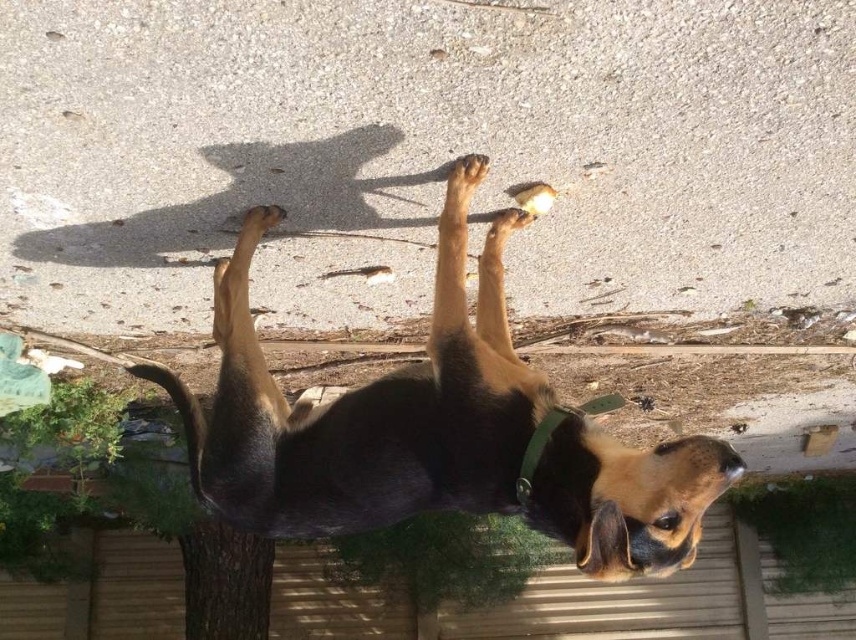
You are a photographer trying to capture the dog in the image. You notice the black fur dog at center and the brown fuzzy paw at upper center. Which object is closer to the camera?

The brown fuzzy paw at upper center is closer to the camera because the black fur dog at center is positioned under it.

You are standing at the position of the dog and want to throw a ball to a friend who is standing at point (513,221). If you throw the ball to point (464,157) first, will the ball pass in front of your friend before reaching the target?

Yes, because point (464,157) is in front of point (513,221), so the ball would pass in front of your friend before reaching the target.

What are the coordinates of the brown fuzzy paw at upper center in the image?

The coordinates of the brown fuzzy paw at upper center are at point (467, 173).